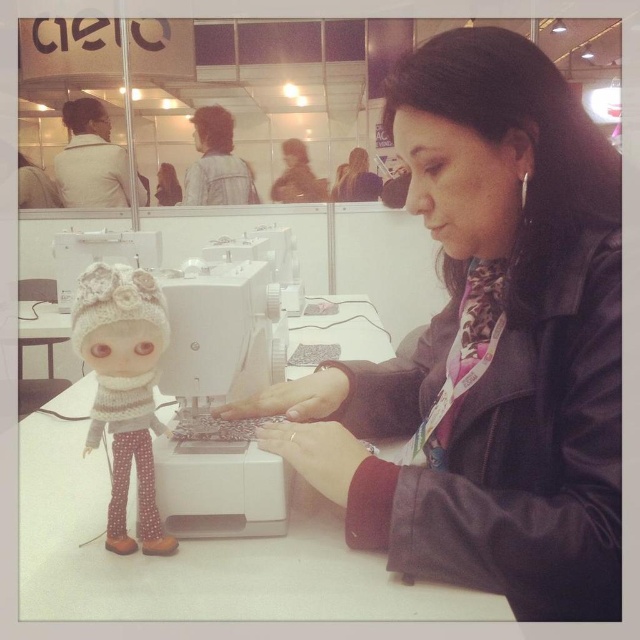
You are a visitor at the craft exhibition and want to take a photo of the leather jacket at center and the leather jacket at upper center together in the frame. What is the minimum distance you need to step back to ensure both are visible?

The two leather jackets are 2.54 meters apart. To capture both in the frame, you need to step back at least 2.54 meters so that the camera can encompass the entire distance between them.

You are a visitor at the craft exhibition and want to take a photo of both the white knitted doll at lower left and the leather jacket at upper center. Which object should you focus on first if you want to capture both in the same frame without moving your camera?

The white knitted doll at lower left is shorter than the leather jacket at upper center, so you should focus on the leather jacket at upper center first to ensure both fit in the frame.

You are an event organizer at the craft exhibition. You need to place a new decorative item between the white knitted doll at lower left and the leather jacket at upper center. Considering their sizes, which object should the new item be placed closer to?

The new decorative item should be placed closer to the leather jacket at upper center because the white knitted doll at lower left has a lesser width compared to the leather jacket at upper center, making the jacket wider and thus requiring more space between them.